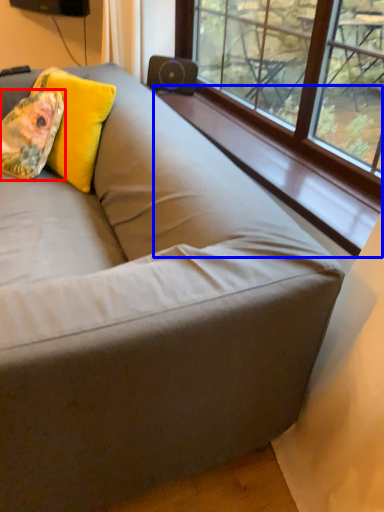
Question: Which of the following is the farthest to the observer, throw pillow (highlighted by a red box) or window sill (highlighted by a blue box)?

Choices:
 (A) throw pillow
 (B) window sill

Answer: (A)